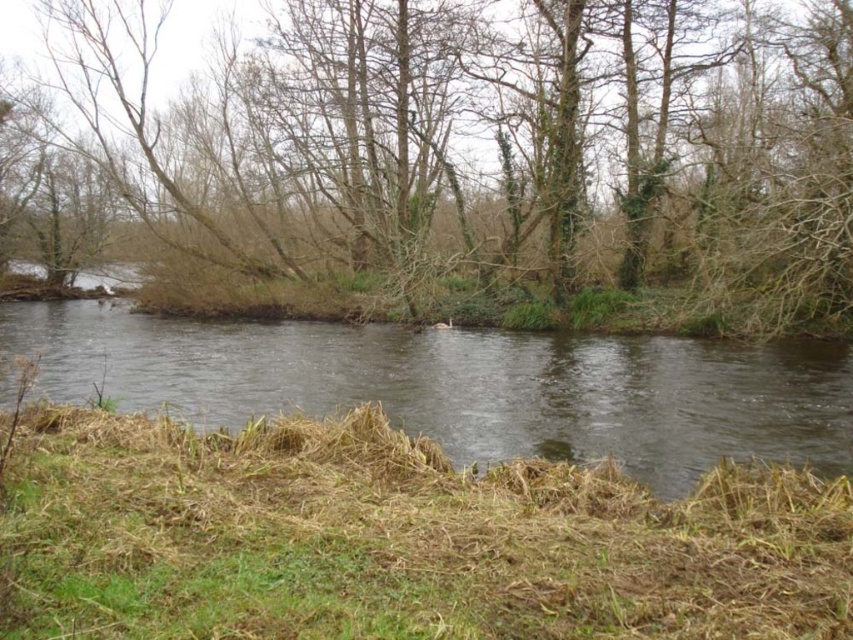
How much distance is there between brown leafless tree at center and brown dry grass at lower center?

They are 33.19 meters apart.

Can you confirm if brown leafless tree at center is bigger than brown dry grass at lower center?

Correct, brown leafless tree at center is larger in size than brown dry grass at lower center.

Locate an element on the screen. The image size is (853, 640). brown leafless tree at center is located at coordinates (460, 157).

Is point (119, 627) farther from camera compared to point (122, 356)?

No, (119, 627) is closer to viewer.

Between point (325, 611) and point (183, 371), which one is positioned behind?

The point (183, 371) is behind.

Find the location of `brown dry grass at lower center`. brown dry grass at lower center is located at coordinates (395, 540).

Can you confirm if brown leafless tree at center is positioned to the left of clear water at center?

Yes, brown leafless tree at center is to the left of clear water at center.

Image resolution: width=853 pixels, height=640 pixels. What do you see at coordinates (460, 157) in the screenshot? I see `brown leafless tree at center` at bounding box center [460, 157].

I want to click on brown leafless tree at center, so click(x=460, y=157).